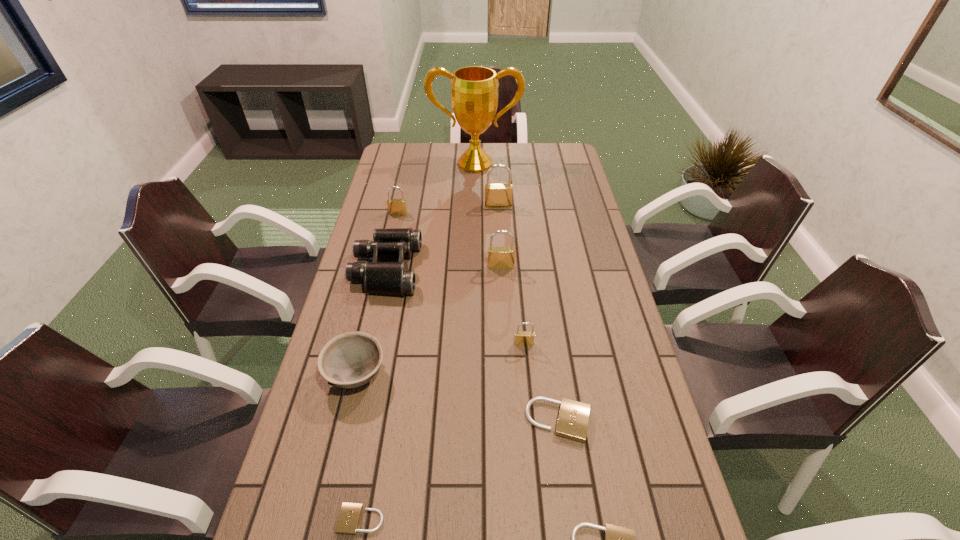
I want to click on vacant space that satisfies the following two spatial constraints: 1. on the front-facing side of the smallest beige padlock; 2. on the right side of the second smallest brass padlock, so click(330, 519).

The image size is (960, 540). I want to click on vacant region that satisfies the following two spatial constraints: 1. on the front-facing side of the black binoculars; 2. on the front side of the gray bowl, so click(362, 374).

In order to click on free space that satisfies the following two spatial constraints: 1. on the front-facing side of the third nearest brass padlock; 2. on the left side of the leftmost beige padlock in this screenshot , I will do `click(330, 519)`.